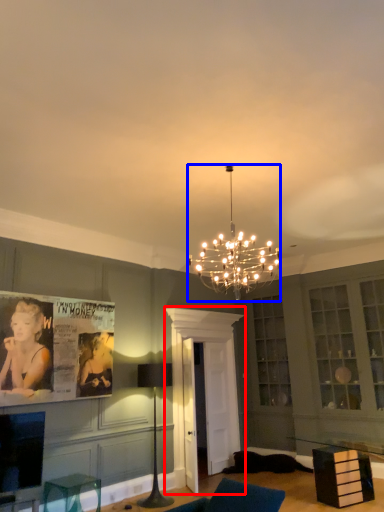
Question: Which of the following is the farthest to the observer, glass door (highlighted by a red box) or lamp (highlighted by a blue box)?

Choices:
 (A) glass door
 (B) lamp

Answer: (A)